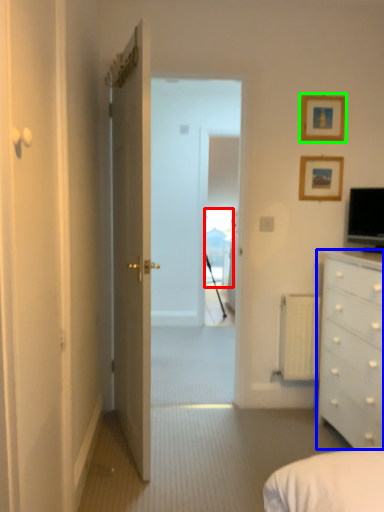
Question: Based on their relative distances, which object is farther from window (highlighted by a red box)? Choose from chest of drawers (highlighted by a blue box) and picture frame (highlighted by a green box).

Choices:
 (A) chest of drawers
 (B) picture frame

Answer: (A)